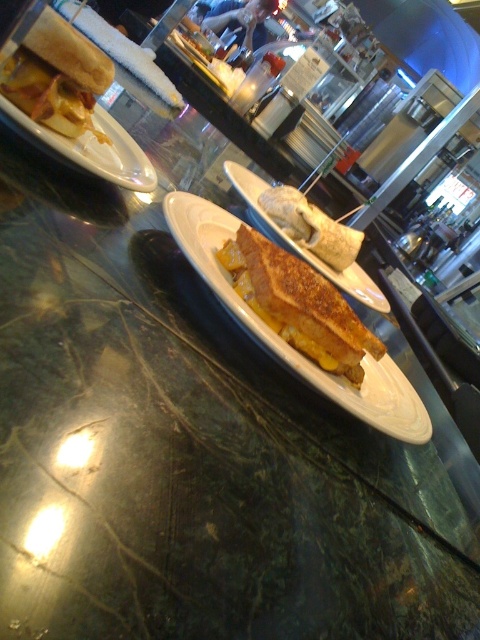
Based on the photo, you are a customer at the deli and want to grab the closest item to you. Which point should you reach for, point (x=288, y=212) or point (x=277, y=237)?

Point (x=288, y=212) is further to the camera than point (x=277, y=237), so you should reach for point (x=277, y=237) as it is closer to you.